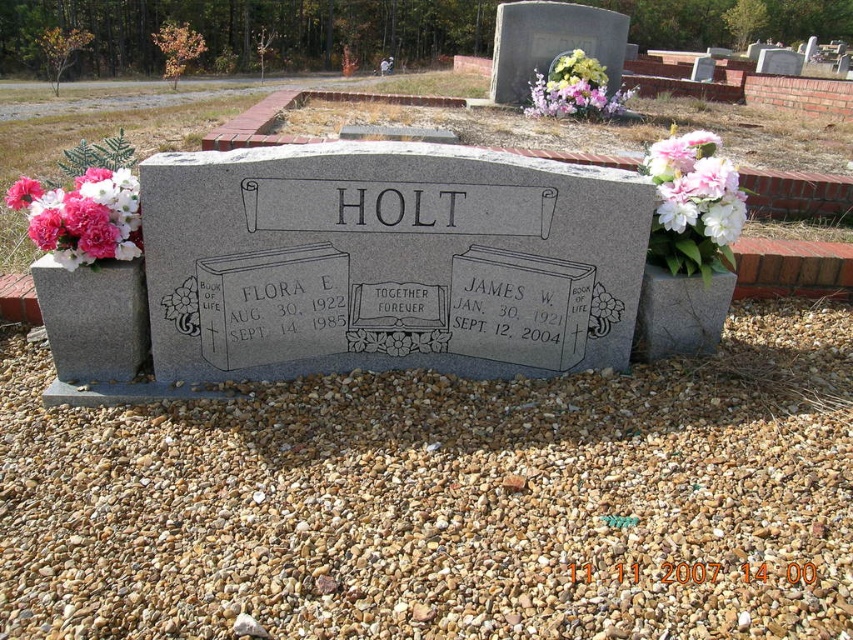
You are a gardener who needs to place a new flower pot that is 2 feet wide between the white matte flowers at upper right and the black stone text at center. Will there be enough space to place the flower pot without overlapping either object?

The distance between the white matte flowers at upper right and the black stone text at center is 4.42 feet. Since the flower pot is 2 feet wide, there is sufficient space as 4.42 feet is greater than 2 feet.

You are standing in front of the gravestone and want to place a small note on the black stone text at center. Can you place it directly in front of the pink floral bouquet at upper center?

The pink floral bouquet at upper center is further to the viewer than the black stone text at center, so you cannot place the note directly in front of the pink floral bouquet at upper center because the black stone text at center is behind it.